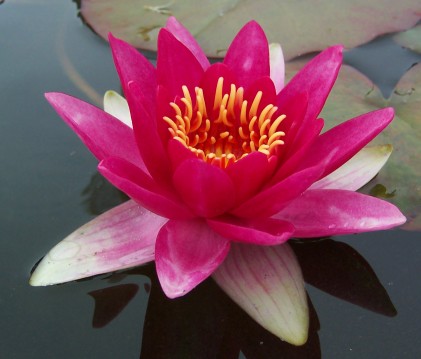
Where is `flower picture`? The image size is (421, 359). flower picture is located at coordinates (179, 77).